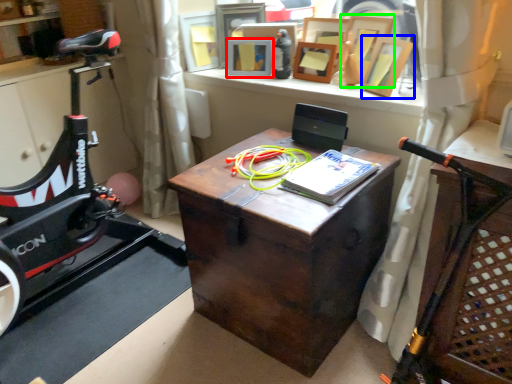
Question: Which is nearer to the picture frame (highlighted by a red box)? picture frame (highlighted by a blue box) or picture frame (highlighted by a green box).

Choices:
 (A) picture frame
 (B) picture frame

Answer: (B)